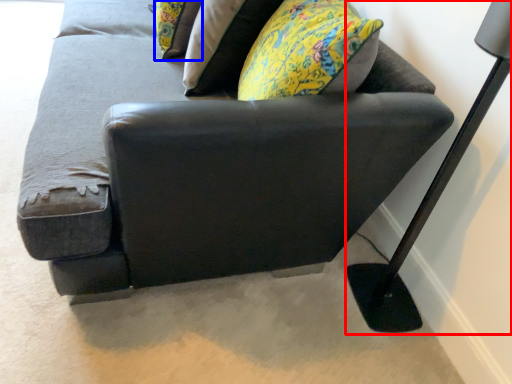
Question: Which point is further to the camera, table lamp (highlighted by a red box) or pillow (highlighted by a blue box)?

Choices:
 (A) table lamp
 (B) pillow

Answer: (B)